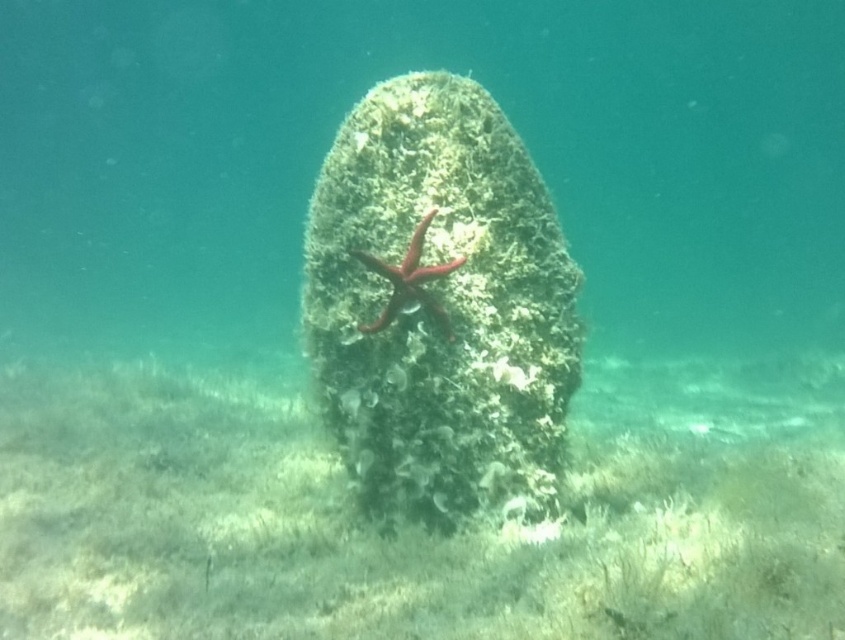
Question: Is greenish stone at center positioned behind red matte starfish at center?

Choices:
 (A) no
 (B) yes

Answer: (B)

Question: Which point is farther from the camera taking this photo?

Choices:
 (A) pyautogui.click(x=513, y=611)
 (B) pyautogui.click(x=377, y=268)
 (C) pyautogui.click(x=369, y=344)

Answer: (C)

Question: Which is farther from the red matte starfish at center?

Choices:
 (A) greenish-brown textured rock at center
 (B) greenish stone at center

Answer: (A)

Question: Is greenish stone at center to the right of red matte starfish at center from the viewer's perspective?

Choices:
 (A) no
 (B) yes

Answer: (B)

Question: Is greenish-brown textured rock at center to the left of red matte starfish at center from the viewer's perspective?

Choices:
 (A) yes
 (B) no

Answer: (B)

Question: Which point is closer to the camera taking this photo?

Choices:
 (A) (363, 488)
 (B) (832, 506)

Answer: (B)